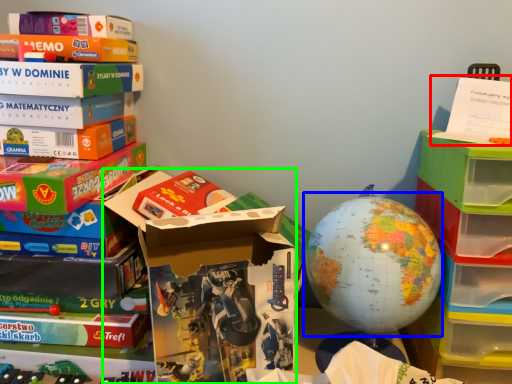
Question: Which object is the farthest from paperback book (highlighted by a red box)? Choose among these: earth (highlighted by a blue box) or storage box (highlighted by a green box).

Choices:
 (A) earth
 (B) storage box

Answer: (B)